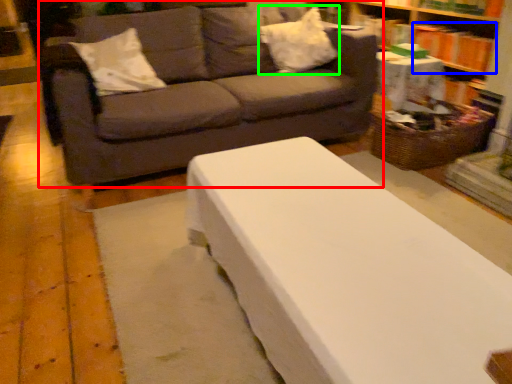
Question: Which is nearer to the studio couch (highlighted by a red box)? book (highlighted by a blue box) or pillow (highlighted by a green box).

Choices:
 (A) book
 (B) pillow

Answer: (B)